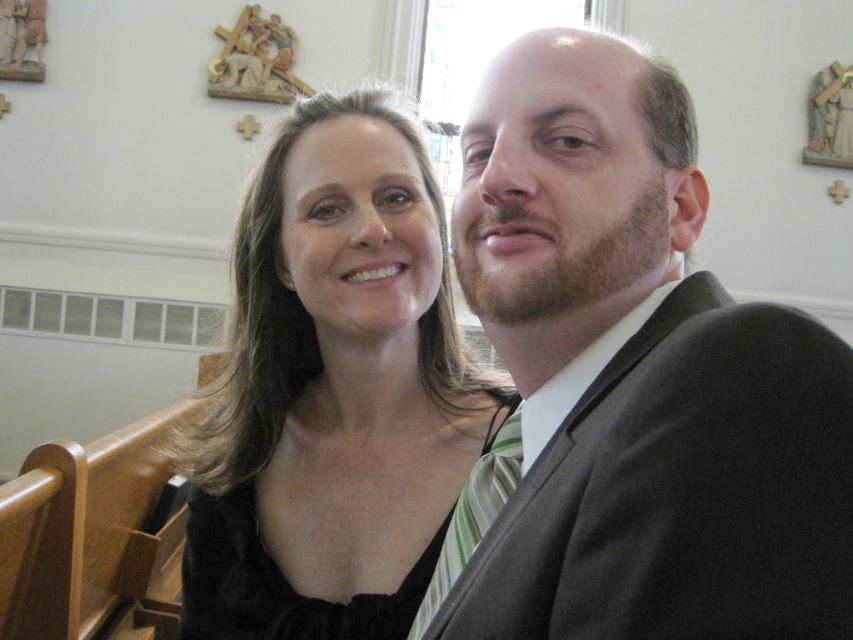
You are a photographer at a wedding ceremony. You need to ensure that the black satin dress at center and the green striped tie at center are both visible in the photo. Given that the camera can only focus on one object at a time, which object should you focus on to ensure the other remains in the background?

The black satin dress at center is bigger than the green striped tie at center, so focusing on the black satin dress at center will keep the green striped tie at center in the background.

You are standing in a church and see two people sitting on a pew. The woman on the left is wearing a black sleeveless top, and the man on the right is dressed in a dark suit with a white shirt and a striped tie. There is a specific point at coordinates [631,381] in the image. What object is located at this point?

The object at point [631,381] is the dark gray suit at right.

You are a photographer at a wedding ceremony. You need to capture a photo of the dark gray suit at right and the black satin dress at center. Based on their positions, which one is lower in the frame?

The dark gray suit at right is below the black satin dress at center, so it is lower in the frame.